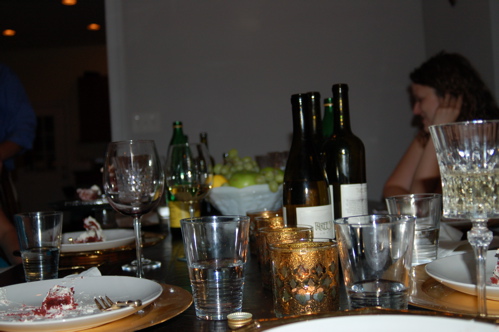
Where is `shot glass`? shot glass is located at coordinates (422, 218), (376, 245), (225, 245), (33, 235).